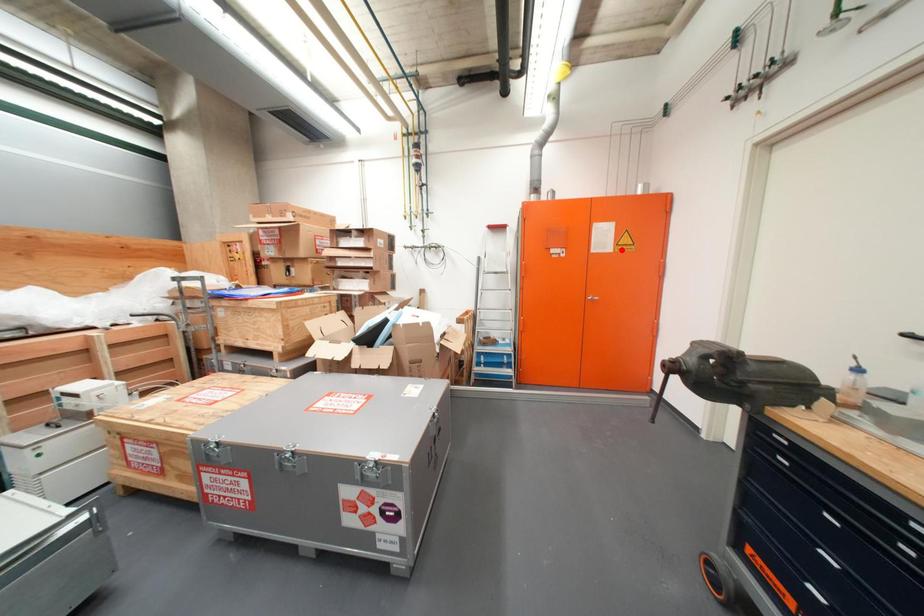
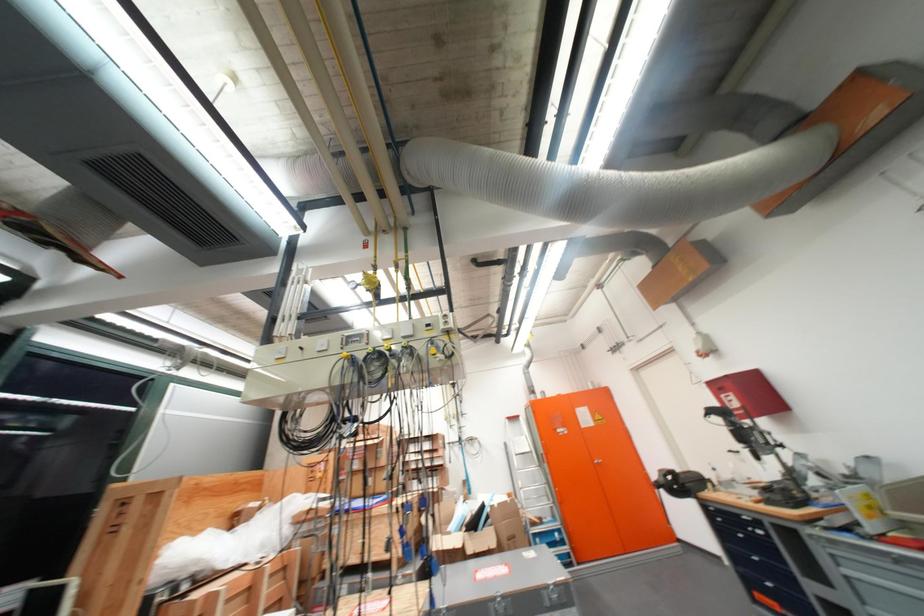
Locate, in the second image, the point that corresponds to the highlighted location in the first image.

(603, 424)